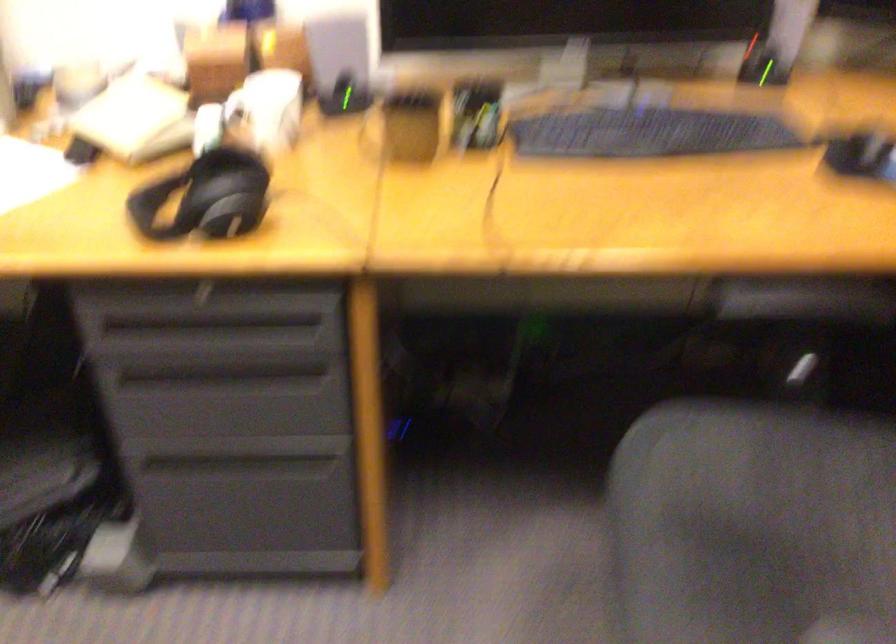
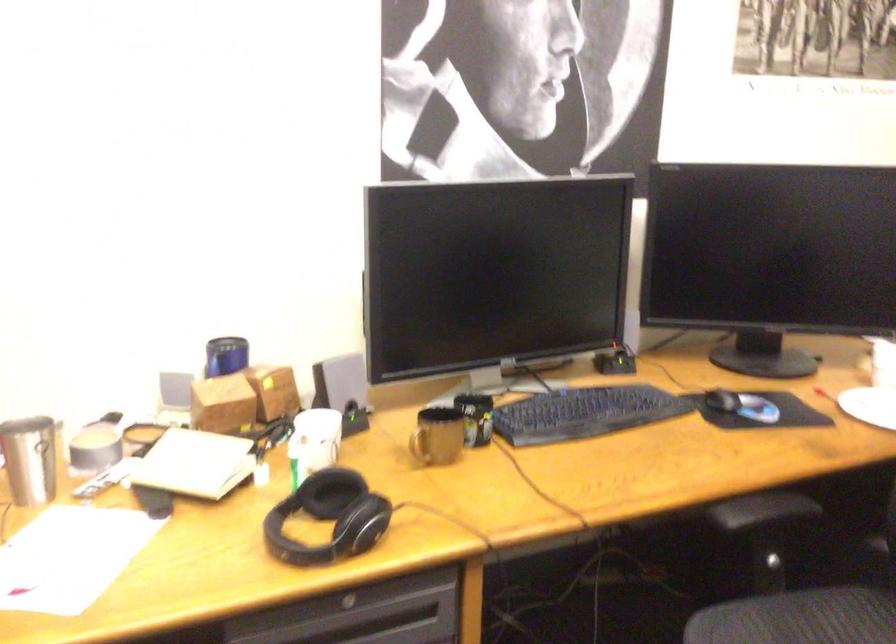
Where in the second image is the point corresponding to [263,111] from the first image?

(314, 440)